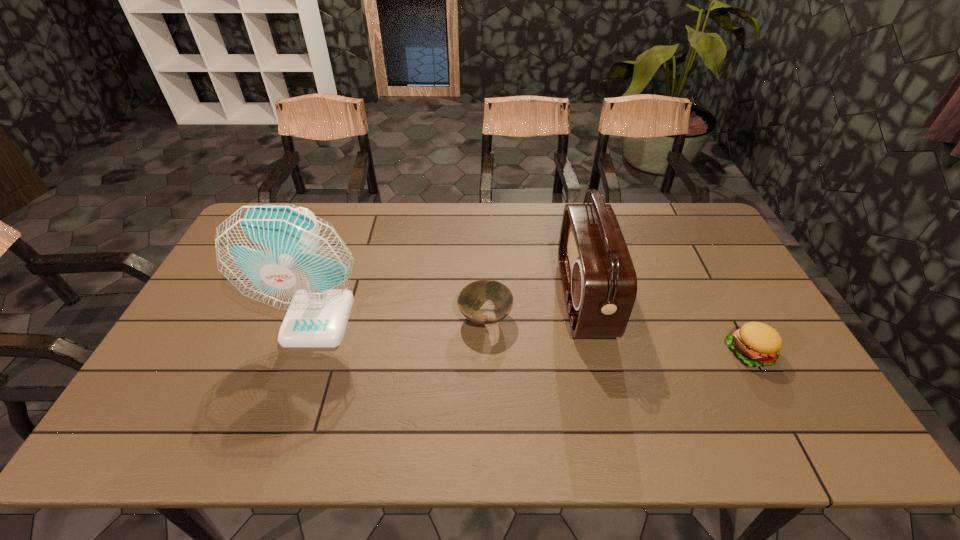
Image resolution: width=960 pixels, height=540 pixels. I want to click on vacant space located on the left of the rightmost object, so click(600, 352).

I want to click on vacant space located 0.270m on the right of the third object from right to left, so click(607, 318).

Locate an element on the screen. object present at the right edge is located at coordinates (756, 343).

The image size is (960, 540). In the image, there is a desktop. What are the coordinates of `vacant space at the far edge` in the screenshot? It's located at (462, 234).

The width and height of the screenshot is (960, 540). In order to click on free space at the near edge of the desktop in this screenshot , I will do `click(276, 428)`.

I want to click on free spot at the left edge of the desktop, so click(x=196, y=389).

Image resolution: width=960 pixels, height=540 pixels. I want to click on free spot at the far right corner of the desktop, so click(x=673, y=211).

Locate an element on the screen. This screenshot has width=960, height=540. free space between the second object from left to right and the tallest object is located at coordinates (402, 318).

You are a GUI agent. You are given a task and a screenshot of the screen. Output one action in this format:
    pyautogui.click(x=<x>, y=<y>)
    Task: Click on the vacant point located between the hamburger and the radio receiver
    The image size is (960, 540).
    Given the screenshot: What is the action you would take?
    point(667,325)

This screenshot has width=960, height=540. What are the coordinates of `vacant space in between the leftmost object and the second object from left to right` in the screenshot? It's located at (402, 318).